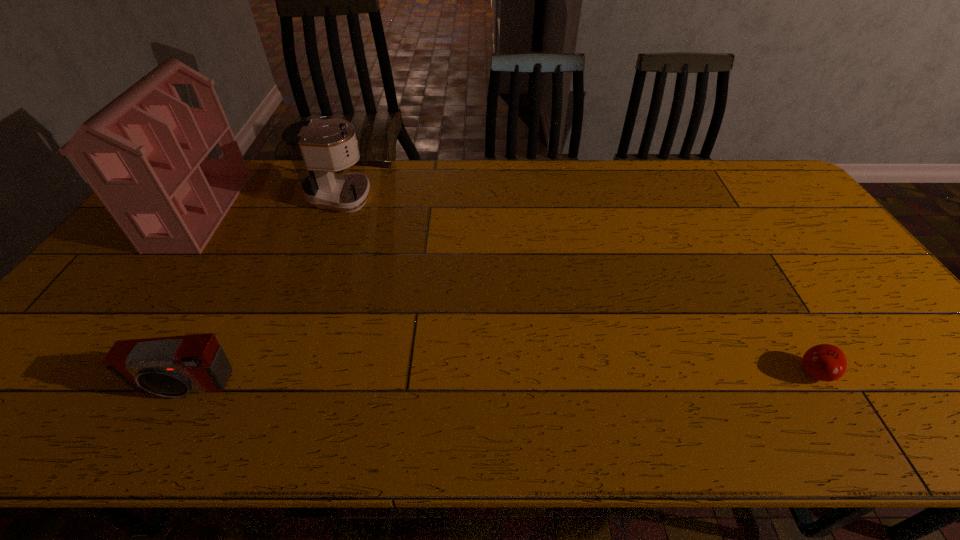
Find the location of a particular element. Image resolution: width=960 pixels, height=540 pixels. the tallest object is located at coordinates (145, 154).

Find the location of `dollhouse`. dollhouse is located at coordinates (145, 154).

In order to click on the second tallest object in this screenshot , I will do `click(317, 148)`.

In order to click on camera in this screenshot , I will do pos(173,366).

The height and width of the screenshot is (540, 960). Identify the location of apple. (825, 362).

What are the coordinates of `the rightmost object` in the screenshot? It's located at (825, 362).

Locate an element on the screen. Image resolution: width=960 pixels, height=540 pixels. free space located on the front-facing side of the dollhouse is located at coordinates (296, 211).

Locate an element on the screen. Image resolution: width=960 pixels, height=540 pixels. blank area located on the front-facing side of the coffee maker is located at coordinates (415, 198).

Identify the location of vacant space located 0.350m on the back of the apple. This screenshot has height=540, width=960. [x=744, y=255].

Where is `dollhouse positioned at the far edge`? This screenshot has height=540, width=960. dollhouse positioned at the far edge is located at coordinates (145, 154).